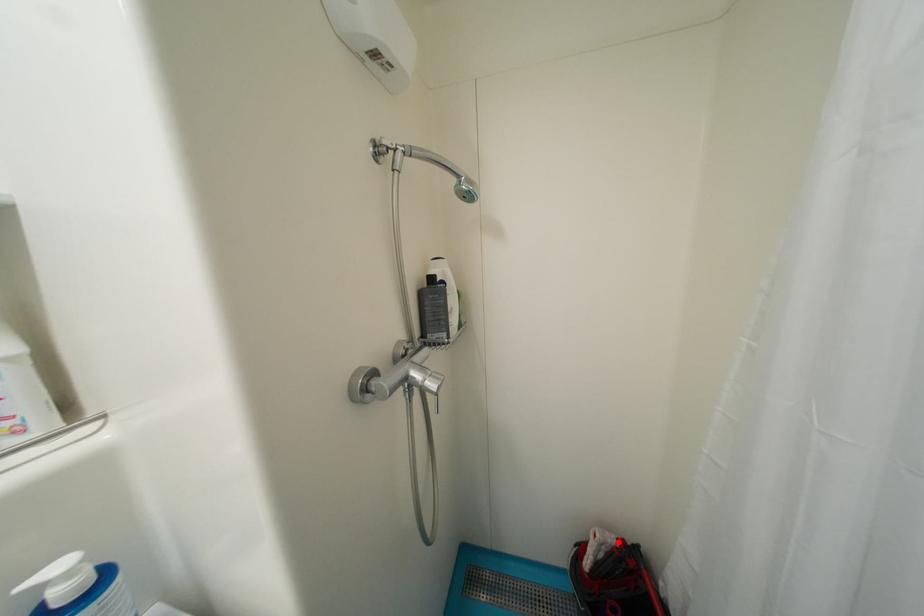
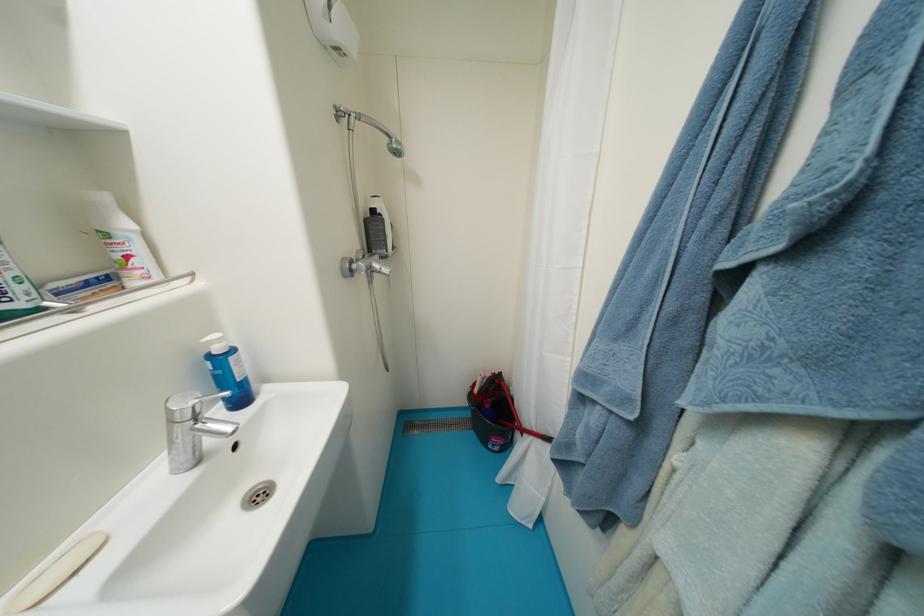
Where in the second image is the point corresponding to the highlighted location from the first image?

(495, 377)